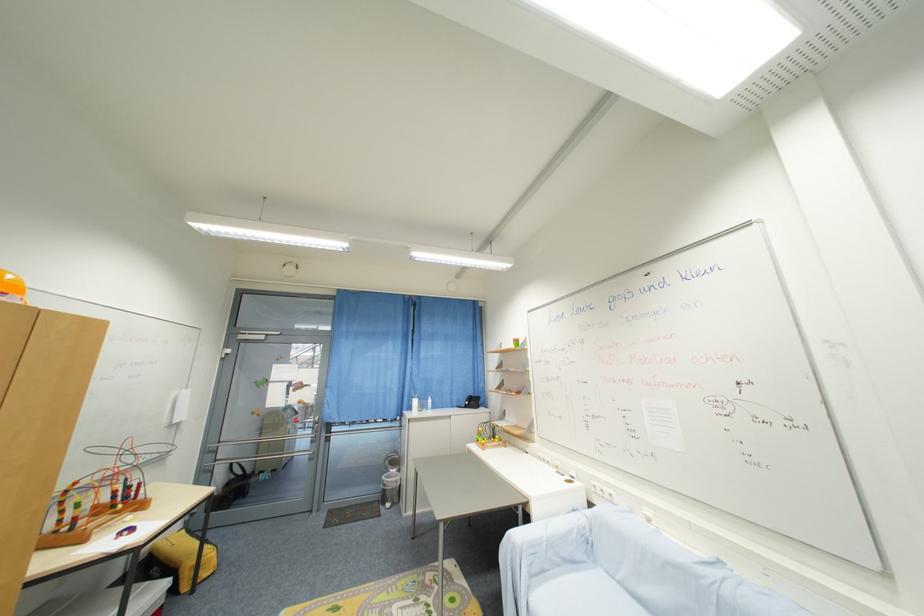
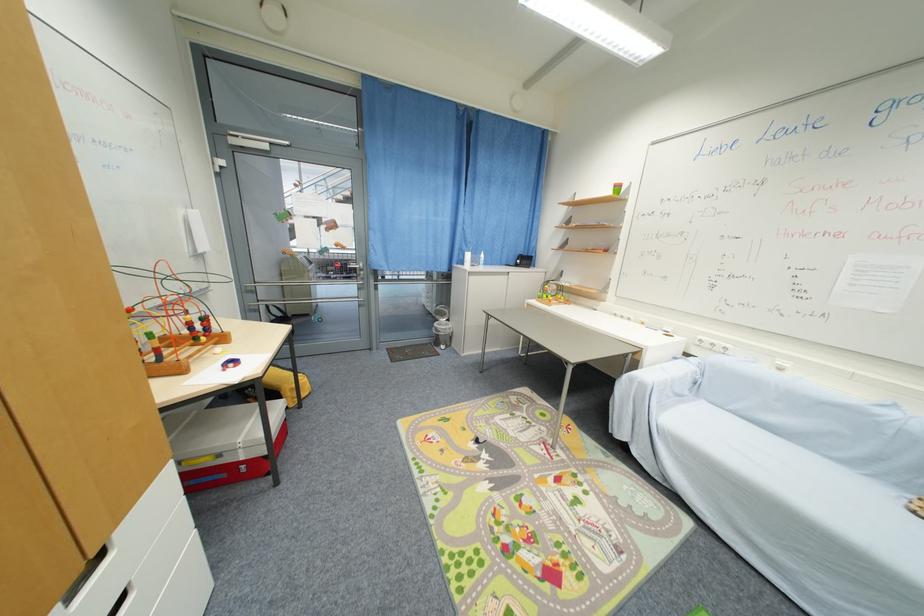
The point at [416,410] is marked in the first image. Where is the corresponding point in the second image?

(467, 264)